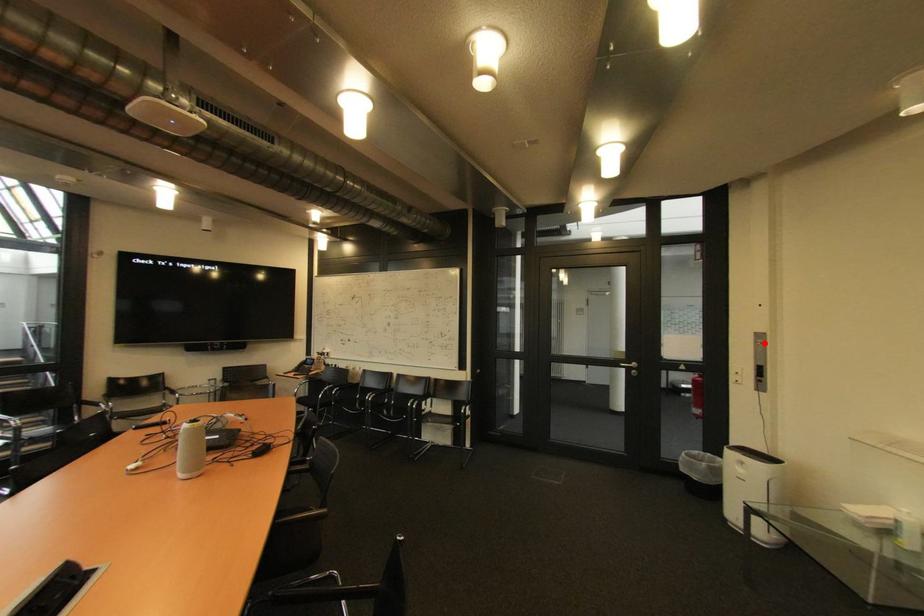
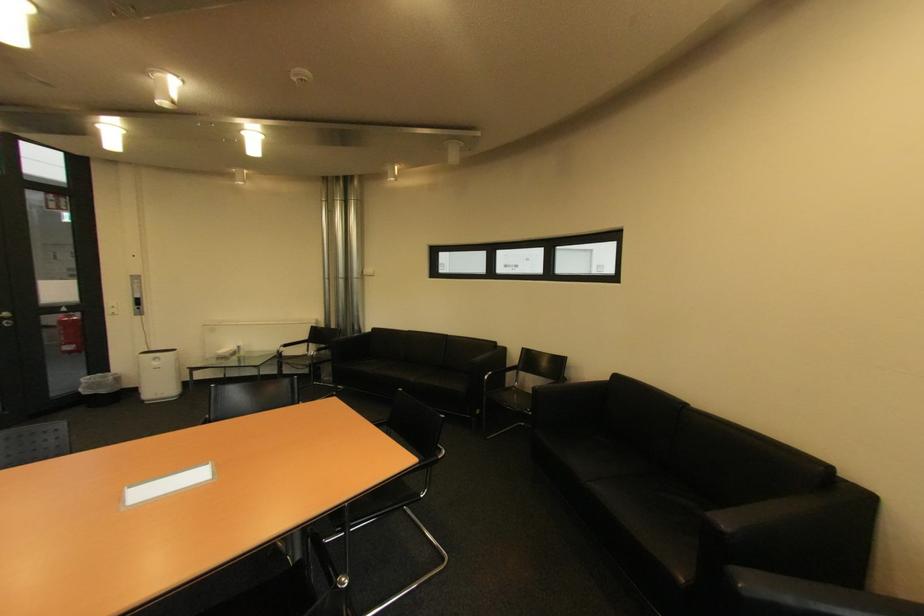
Question: I am providing you with two images of the same scene from different viewpoints. A red point is marked on the first image. At the location where the point appears in image 1, is it still visible in image 2?

Choices:
 (A) Yes
 (B) No

Answer: (A)